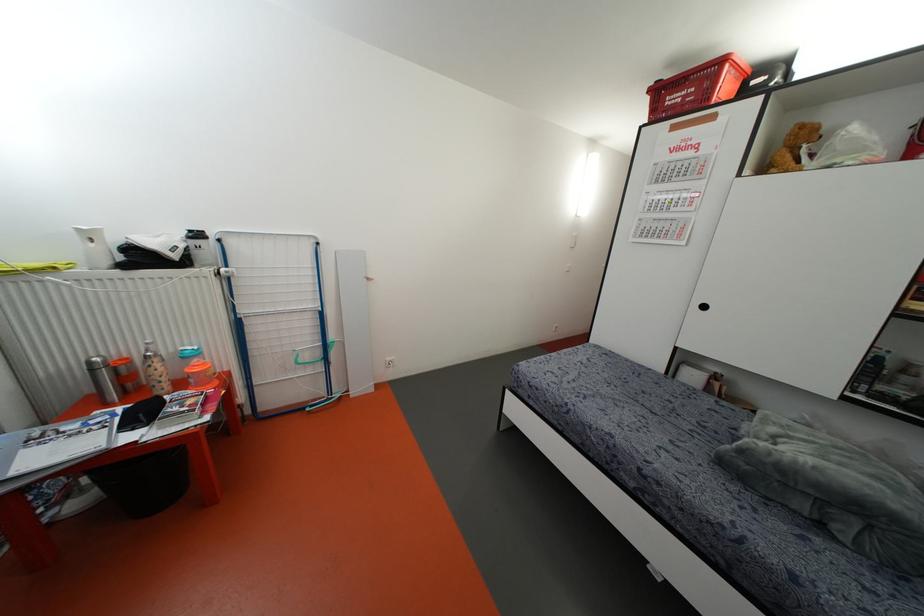
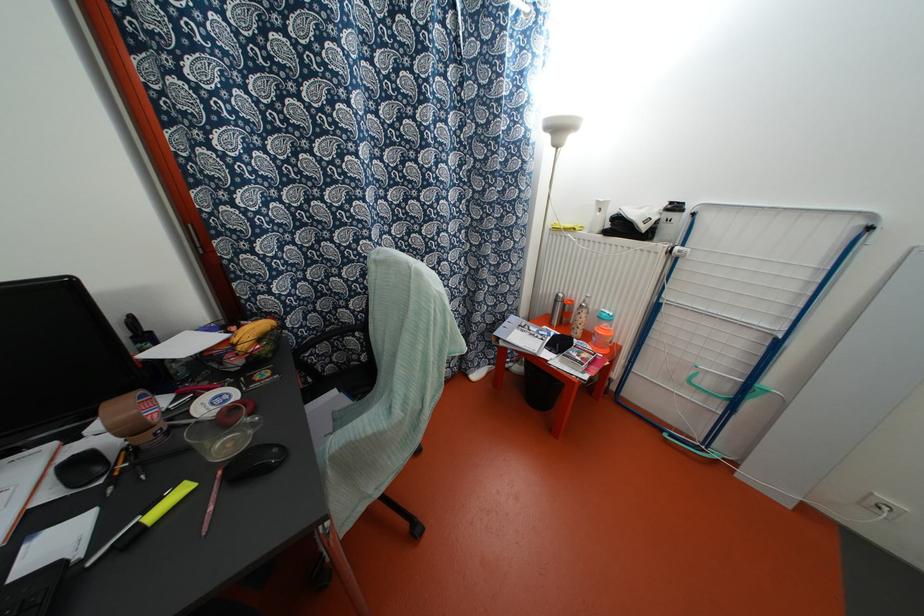
The point at (155, 360) is marked in the first image. Where is the corresponding point in the second image?

(584, 310)